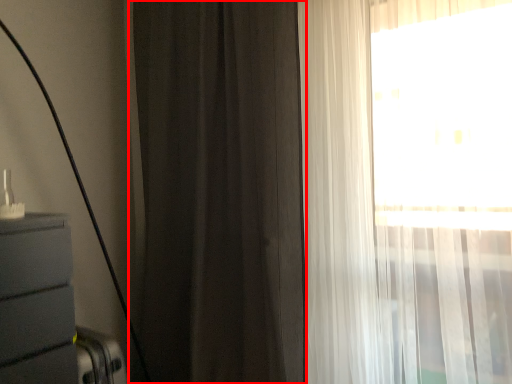
Question: In this image, where is curtain (annotated by the red box) located relative to curtain?

Choices:
 (A) left
 (B) right

Answer: (A)